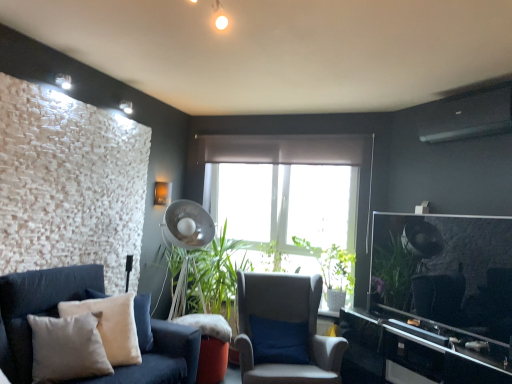
Question: Does black glossy entertainment center at right have a greater width compared to beige velvet pillow at lower left?

Choices:
 (A) no
 (B) yes

Answer: (B)

Question: Is black glossy entertainment center at right bigger than beige velvet pillow at lower left?

Choices:
 (A) yes
 (B) no

Answer: (A)

Question: Is black glossy entertainment center at right outside beige velvet pillow at lower left?

Choices:
 (A) no
 (B) yes

Answer: (B)

Question: Is black glossy entertainment center at right positioned with its back to beige velvet pillow at lower left?

Choices:
 (A) yes
 (B) no

Answer: (B)

Question: Considering the relative sizes of black glossy entertainment center at right and beige velvet pillow at lower left in the image provided, is black glossy entertainment center at right thinner than beige velvet pillow at lower left?

Choices:
 (A) yes
 (B) no

Answer: (B)

Question: From a real-world perspective, is black glossy entertainment center at right located beneath beige velvet pillow at lower left?

Choices:
 (A) no
 (B) yes

Answer: (B)

Question: From a real-world perspective, is metallic silver mechanical fan at center beneath white sheer curtain at center?

Choices:
 (A) yes
 (B) no

Answer: (A)

Question: Can you confirm if metallic silver mechanical fan at center is thinner than white sheer curtain at center?

Choices:
 (A) no
 (B) yes

Answer: (A)

Question: Does metallic silver mechanical fan at center appear on the left side of white sheer curtain at center?

Choices:
 (A) yes
 (B) no

Answer: (A)

Question: From a real-world perspective, is metallic silver mechanical fan at center located higher than white sheer curtain at center?

Choices:
 (A) no
 (B) yes

Answer: (A)

Question: Is metallic silver mechanical fan at center closer to the viewer compared to white sheer curtain at center?

Choices:
 (A) yes
 (B) no

Answer: (A)

Question: Can you confirm if metallic silver mechanical fan at center is smaller than white sheer curtain at center?

Choices:
 (A) yes
 (B) no

Answer: (B)

Question: Considering the relative sizes of light gray fabric chair at center and black glossy entertainment center at right in the image provided, is light gray fabric chair at center taller than black glossy entertainment center at right?

Choices:
 (A) yes
 (B) no

Answer: (A)